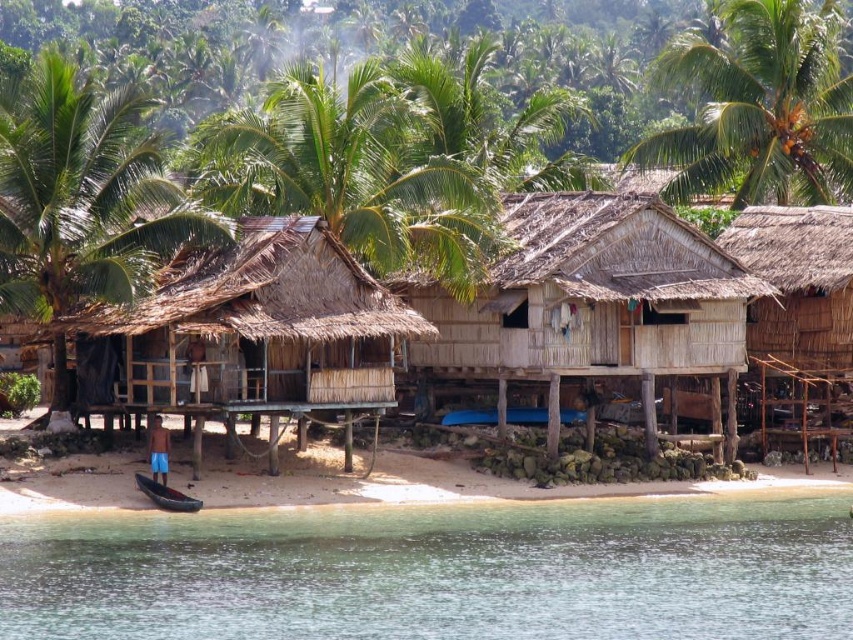
You are standing on the beach in front of the stilt houses and want to take a photo of the green leafy palm tree at upper right. If your camera has a zoom range up to 100 meters, will you need to use the zoom to capture the tree in the photo?

The green leafy palm tree at upper right is 104.78 meters away from the viewer. Since the camera can zoom up to 100 meters, you will need to use the zoom to capture the tree in the photo.

You are standing on the beach looking towards the green leafy palm tree at upper left and the green leafy palm tree at upper right. Which palm tree is positioned lower in the scene?

The green leafy palm tree at upper left is positioned below the green leafy palm tree at upper right, so it is lower in the scene.

You are standing on the beach looking towards the green leafy palm tree at upper center and the green leafy palm tree at upper left. Which one appears closer to you?

The green leafy palm tree at upper center appears closer because the green leafy palm tree at upper left is positioned behind it.